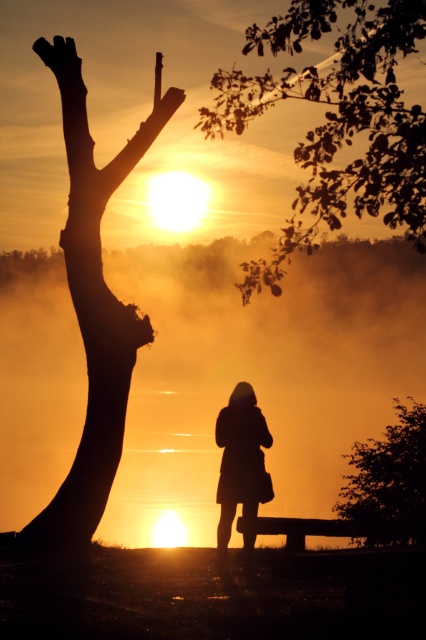
Is point (344, 172) farther from camera compared to point (69, 76)?

That is False.

Is smooth bark tree at upper right above silky smooth hand at upper left?

Incorrect, smooth bark tree at upper right is not positioned above silky smooth hand at upper left.

At what (x,y) coordinates should I click in order to perform the action: click on smooth bark tree at upper right. Please return your answer as a coordinate pair (x, y). Looking at the image, I should click on (336, 120).

I want to click on smooth bark tree at upper right, so click(x=336, y=120).

Can you confirm if silhouette leafy tree at upper right is taller than silky smooth hand at upper left?

Indeed, silhouette leafy tree at upper right has a greater height compared to silky smooth hand at upper left.

Between point (354, 534) and point (69, 48), which one is positioned behind?

Point (354, 534)

Identify the location of silhouette leafy tree at upper right. (388, 483).

Can you confirm if silhouette wood at left is positioned to the left of black matte arm at center?

Correct, you'll find silhouette wood at left to the left of black matte arm at center.

Which of these two, silhouette wood at left or black matte arm at center, stands taller?

silhouette wood at left is taller.

Between point (37, 538) and point (253, 406), which one is positioned behind?

Positioned behind is point (253, 406).

Where is `silhouette wood at left`? silhouette wood at left is located at coordinates (94, 332).